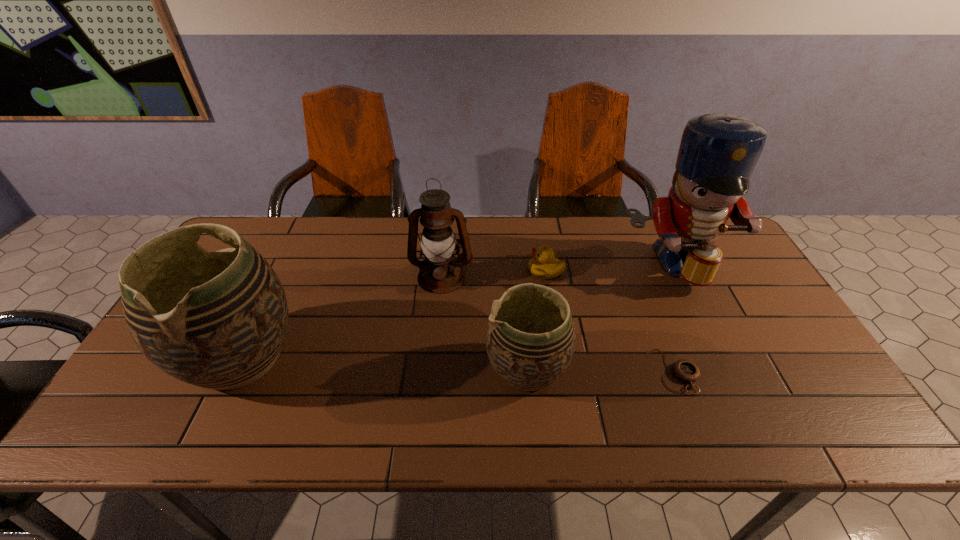
Where is `object that is at the left edge`? object that is at the left edge is located at coordinates (218, 320).

The height and width of the screenshot is (540, 960). I want to click on object located in the right edge section of the desktop, so click(x=718, y=152).

This screenshot has height=540, width=960. Identify the location of object located at the near left corner. (218, 320).

Identify the location of object located at the far right corner. This screenshot has height=540, width=960. (718, 152).

Identify the location of vacant position at the far edge of the desktop. (325, 252).

Locate an element on the screen. This screenshot has height=540, width=960. free space at the near edge is located at coordinates (322, 378).

The height and width of the screenshot is (540, 960). I want to click on vacant area at the right edge, so click(x=734, y=265).

You are a GUI agent. You are given a task and a screenshot of the screen. Output one action in this format:
    pyautogui.click(x=<x>, y=<y>)
    Task: Click on the free space at the far left corner of the desktop
    The height and width of the screenshot is (540, 960).
    Given the screenshot: What is the action you would take?
    pyautogui.click(x=256, y=247)

Locate an element on the screen. The height and width of the screenshot is (540, 960). vacant space in between the lantern and the fourth tallest object is located at coordinates (484, 323).

Find the location of a particular element. blank region between the third shortest object and the lantern is located at coordinates (484, 323).